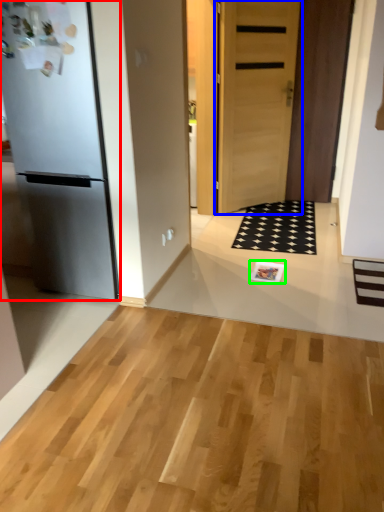
Question: Estimate the real-world distances between objects in this image. Which object is farther from refrigerator (highlighted by a red box), door (highlighted by a blue box) or magazine (highlighted by a green box)?

Choices:
 (A) door
 (B) magazine

Answer: (A)